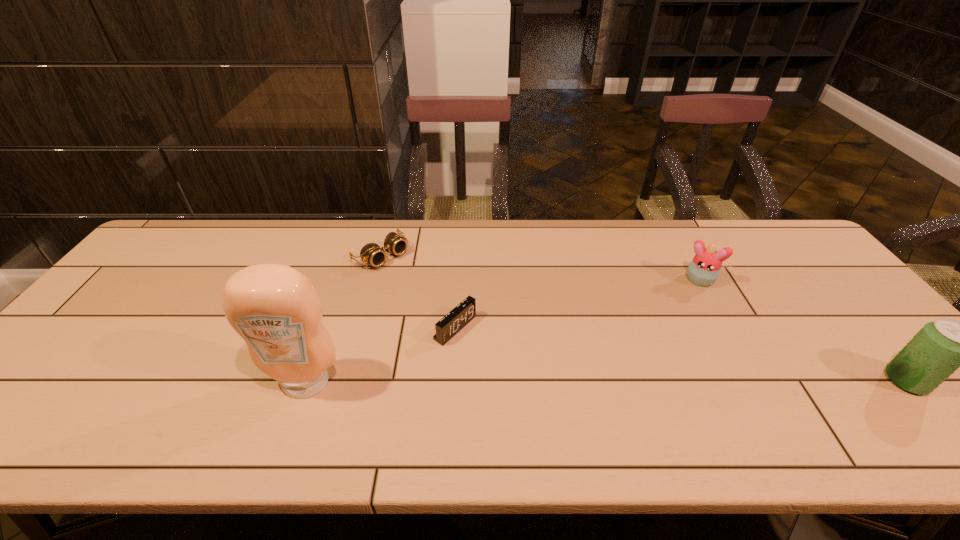
Find the location of a particular element. condiment is located at coordinates (276, 309).

At what (x,y) coordinates should I click in order to perform the action: click on the second tallest object. Please return your answer as a coordinate pair (x, y). The image size is (960, 540). Looking at the image, I should click on (939, 348).

What are the coordinates of `soda` in the screenshot? It's located at (939, 348).

Identify the location of goggles. The image size is (960, 540). (371, 253).

You are a GUI agent. You are given a task and a screenshot of the screen. Output one action in this format:
    pyautogui.click(x=<x>, y=<y>)
    Task: Click on the alarm clock
    The image size is (960, 540).
    Given the screenshot: What is the action you would take?
    pyautogui.click(x=446, y=328)

Find the location of `the third nearest object`. the third nearest object is located at coordinates (446, 328).

I want to click on the third tallest object, so click(704, 269).

Find the location of a particular element. Image resolution: width=960 pixels, height=540 pixels. the fourth object from left to right is located at coordinates (704, 269).

The image size is (960, 540). Identify the location of vacant space located on the left of the rightmost object. (830, 381).

You are a GUI agent. You are given a task and a screenshot of the screen. Output one action in this format:
    pyautogui.click(x=<x>, y=<y>)
    Task: Click on the vacant region located 0.190m through the lenses of the goggles
    Image resolution: width=960 pixels, height=540 pixels.
    Given the screenshot: What is the action you would take?
    pyautogui.click(x=440, y=298)